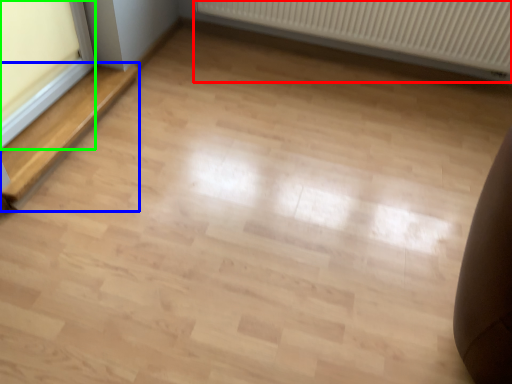
Question: Based on their relative distances, which object is farther from radiator (highlighted by a red box)? Choose from stairwell (highlighted by a blue box) and window frame (highlighted by a green box).

Choices:
 (A) stairwell
 (B) window frame

Answer: (B)